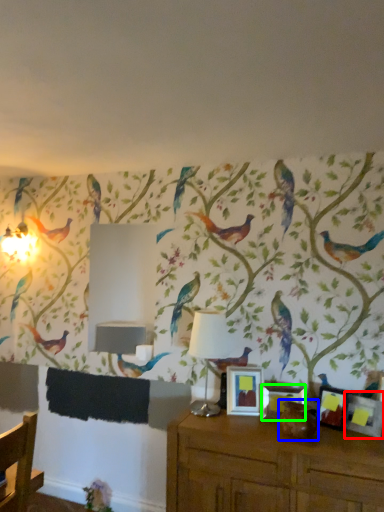
Question: Estimate the real-world distances between objects in this image. Which object is closer to picture frame (highlighted by a red box), animal (highlighted by a blue box) or picture frame (highlighted by a green box)?

Choices:
 (A) animal
 (B) picture frame

Answer: (A)